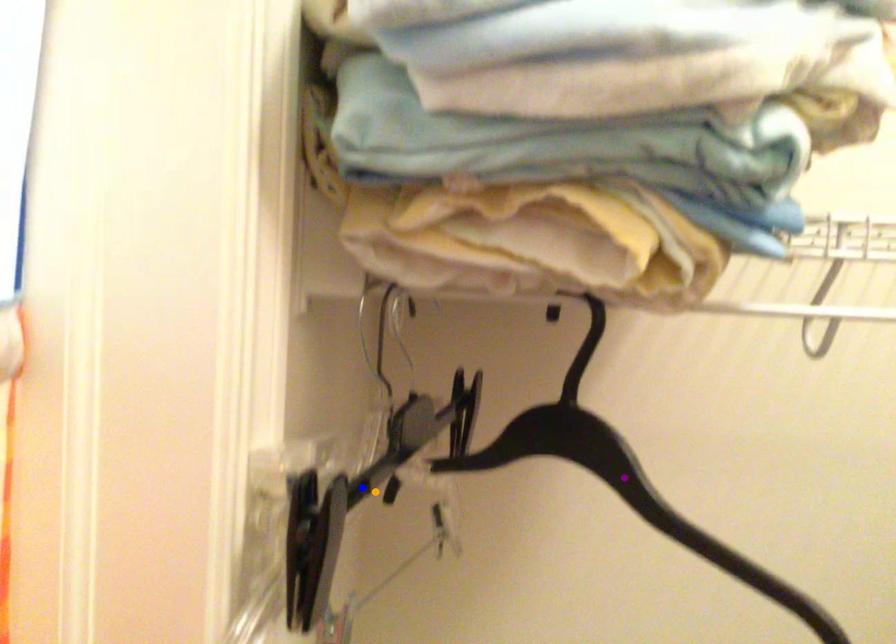
Order these from nearest to farthest:
purple point
blue point
orange point

purple point
blue point
orange point